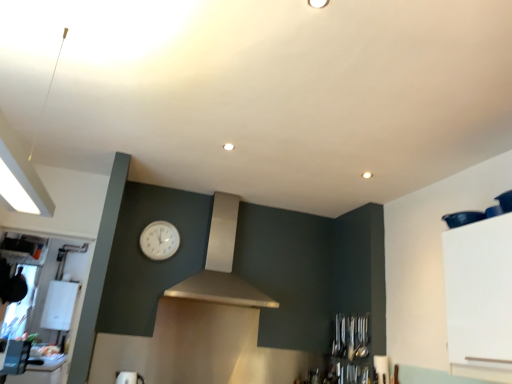
Question: Which is correct: white plastic boiler at left, the first appliance viewed from the back, is inside white plastic toaster at lower left, which is the second appliance in left-to-right order, or outside of it?

Choices:
 (A) outside
 (B) inside

Answer: (A)

Question: Visually, is white plastic boiler at left, which is counted as the 1th appliance, starting from the left, positioned to the left or to the right of white plastic toaster at lower left, arranged as the 1th appliance when viewed from the right?

Choices:
 (A) left
 (B) right

Answer: (A)

Question: Which object is positioned farthest from the white plastic toaster at lower left, which appears as the first appliance when viewed from the front?

Choices:
 (A) white plastic boiler at left, the second appliance in the right-to-left sequence
 (B) white plastic clock at center
 (C) satin white vent at center

Answer: (A)

Question: Considering the real-world distances, which object is closest to the satin white vent at center?

Choices:
 (A) white plastic boiler at left, the first appliance viewed from the back
 (B) white plastic toaster at lower left, which appears as the first appliance when viewed from the front
 (C) white plastic clock at center

Answer: (C)